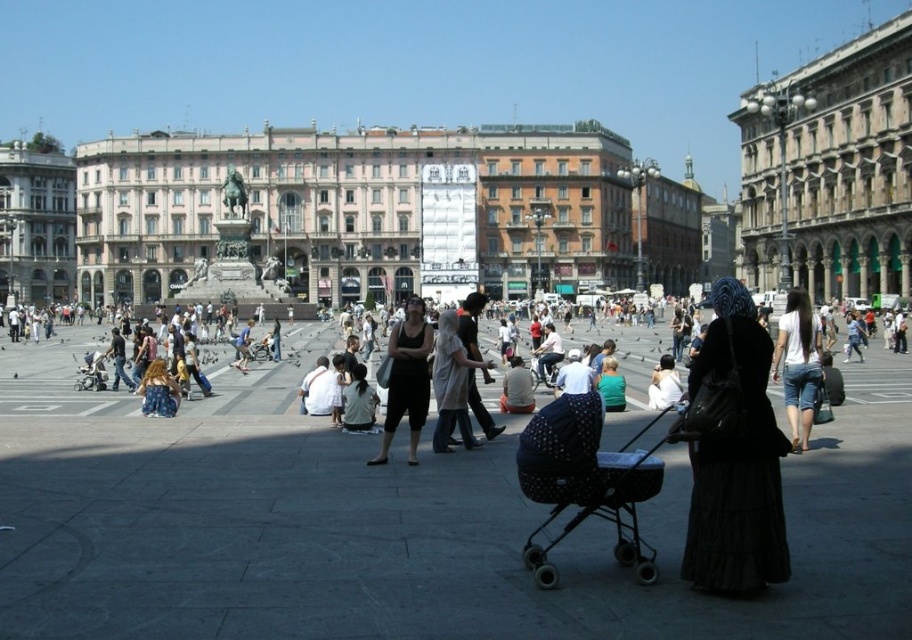
You are a tourist holding a map in your hand. You want to take a photo of the polka dot fabric baby carriage at center and the beige stone building at right in the same frame. Which object should you focus on first to ensure both are in the shot?

You should focus on the beige stone building at right first because it is larger than the polka dot fabric baby carriage at center, so you need to ensure it fits properly before adjusting the frame for the smaller object.

You are a tourist in the square and want to take a photo of the matte black tank top at center and the polka dot fabric baby carriage at center. Which one should you focus on first if you want to capture both in the frame without moving the camera?

You should focus on the matte black tank top at center first since the polka dot fabric baby carriage at center is to the right of it, so keeping the camera steady and centered on the matte black tank top at center will ensure both are in the frame.